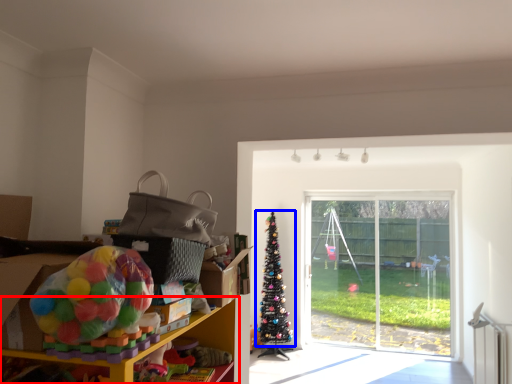
Question: Which point is closer to the camera, shelf (highlighted by a red box) or christmas tree (highlighted by a blue box)?

Choices:
 (A) shelf
 (B) christmas tree

Answer: (A)